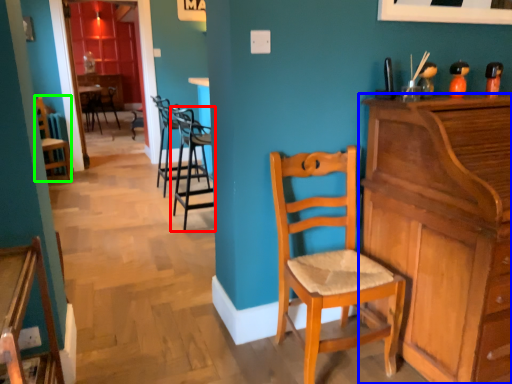
Question: Which is farther away from chair (highlighted by a red box)? cabinetry (highlighted by a blue box) or chair (highlighted by a green box)?

Choices:
 (A) cabinetry
 (B) chair

Answer: (A)